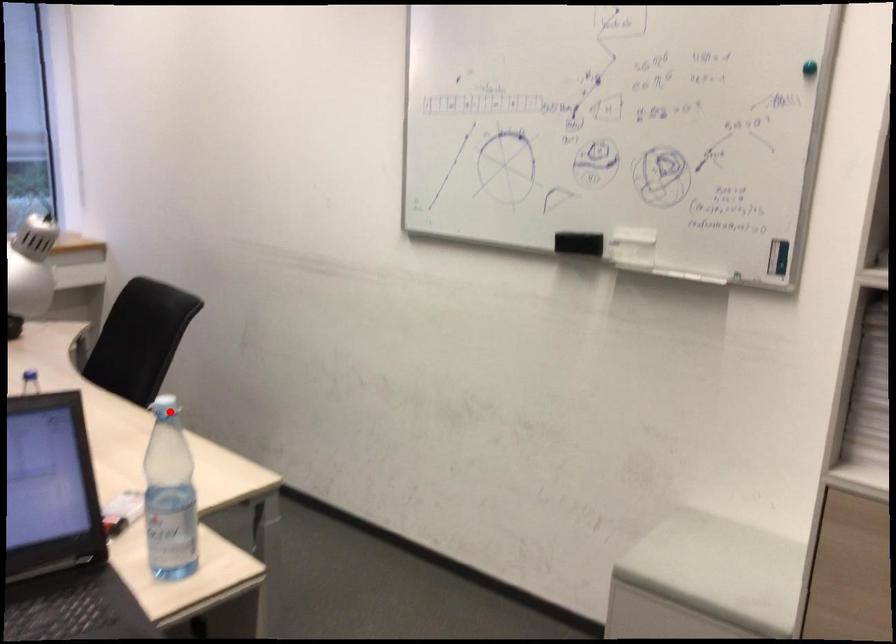
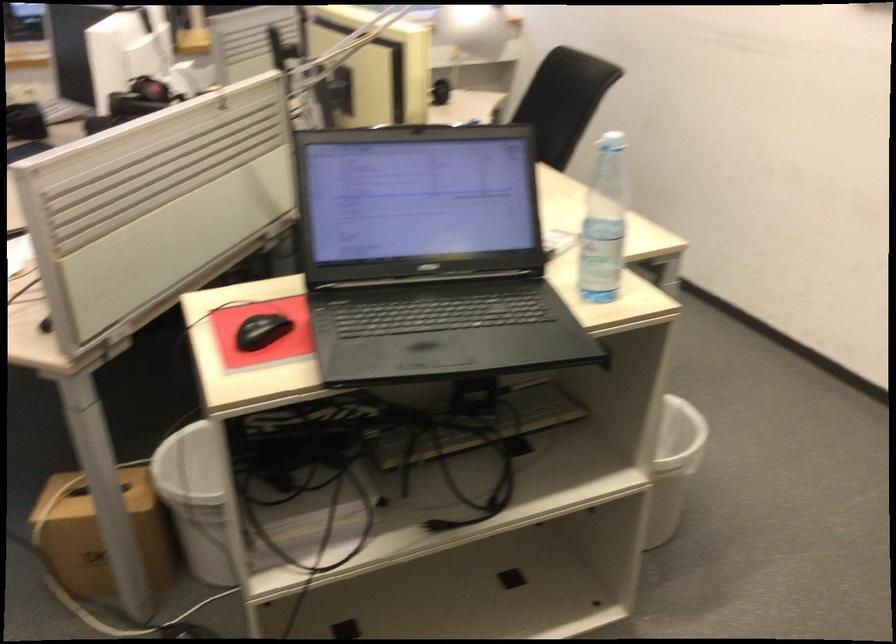
Locate, in the second image, the point that corresponds to the highlighted location in the first image.

(612, 142)